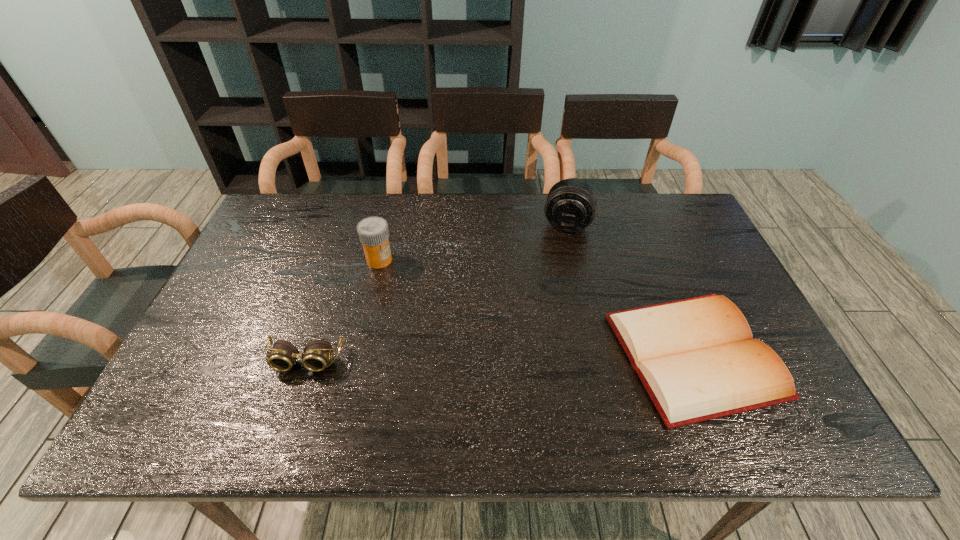
Where is `blank space located on the front-facing side of the farthest object`? blank space located on the front-facing side of the farthest object is located at coordinates (550, 297).

The image size is (960, 540). In order to click on blank space located on the front-facing side of the farthest object in this screenshot , I will do `click(546, 316)`.

At what (x,y) coordinates should I click in order to perform the action: click on vacant region located 0.400m on the front-facing side of the farthest object. Please return your answer as a coordinate pair (x, y). Looking at the image, I should click on (541, 337).

Locate an element on the screen. Image resolution: width=960 pixels, height=540 pixels. object situated at the far edge is located at coordinates (570, 207).

Image resolution: width=960 pixels, height=540 pixels. What are the coordinates of `goggles located in the near edge section of the desktop` in the screenshot? It's located at (317, 353).

Find the location of a particular element. Bible at the near edge is located at coordinates (696, 358).

This screenshot has width=960, height=540. What are the coordinates of `object that is at the right edge` in the screenshot? It's located at (696, 358).

Locate an element on the screen. object present at the near right corner is located at coordinates (696, 358).

Locate an element on the screen. free space at the far edge of the desktop is located at coordinates (463, 197).

Find the location of a particular element. vacant space at the near edge of the desktop is located at coordinates (299, 384).